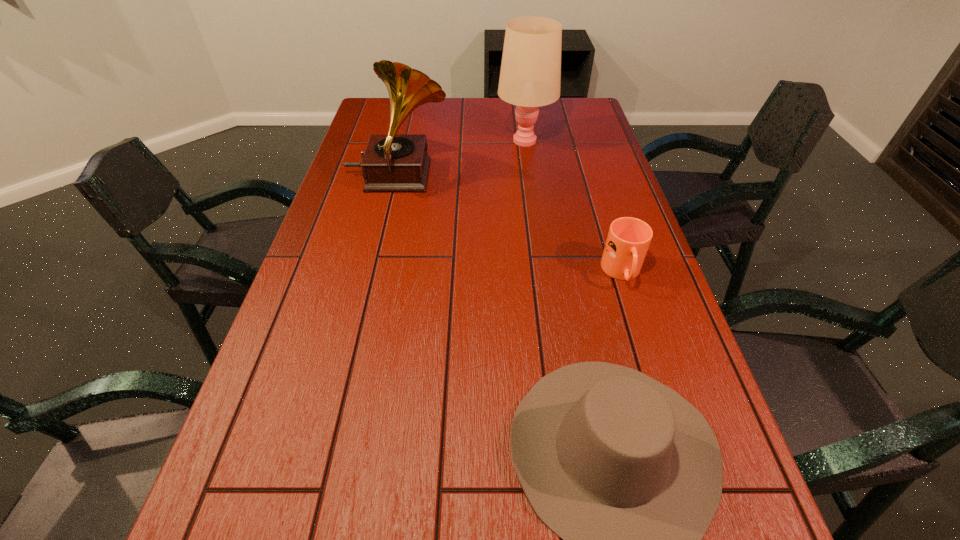
Select which object is the third closest to the nearest object. Please provide its 2D coordinates. Your answer should be formatted as a tuple, i.e. [(x, y)], where the tuple contains the x and y coordinates of a point satisfying the conditions above.

[(530, 76)]